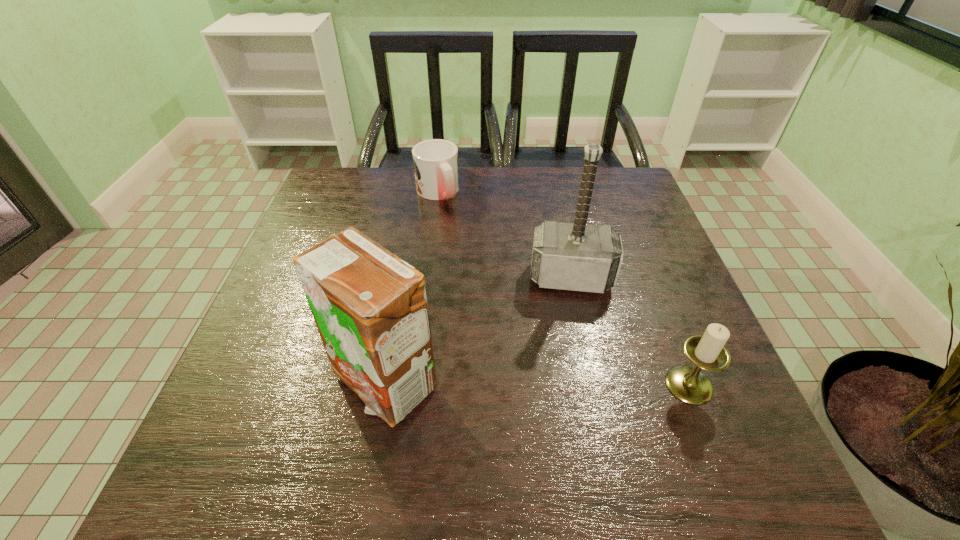
The width and height of the screenshot is (960, 540). I want to click on vacant space at the far edge of the desktop, so click(x=489, y=177).

In order to click on free space at the near edge in this screenshot , I will do `click(450, 423)`.

Where is `vacant area at the left edge of the desktop`? vacant area at the left edge of the desktop is located at coordinates (270, 321).

Identify the location of free space at the right edge. The height and width of the screenshot is (540, 960). (623, 218).

Locate an element on the screen. vacant area at the far left corner is located at coordinates (365, 207).

The width and height of the screenshot is (960, 540). Identify the location of vacant space at the near left corner. (270, 414).

The height and width of the screenshot is (540, 960). I want to click on free region at the far right corner, so click(641, 198).

This screenshot has height=540, width=960. What are the coordinates of `free point between the hammer and the carton` in the screenshot? It's located at (477, 330).

At what (x,y) coordinates should I click in order to perform the action: click on free space between the carton and the third object from left to right. Please return your answer as a coordinate pair (x, y). Looking at the image, I should click on (477, 330).

The width and height of the screenshot is (960, 540). Identify the location of empty space between the mug and the second farthest object. (504, 235).